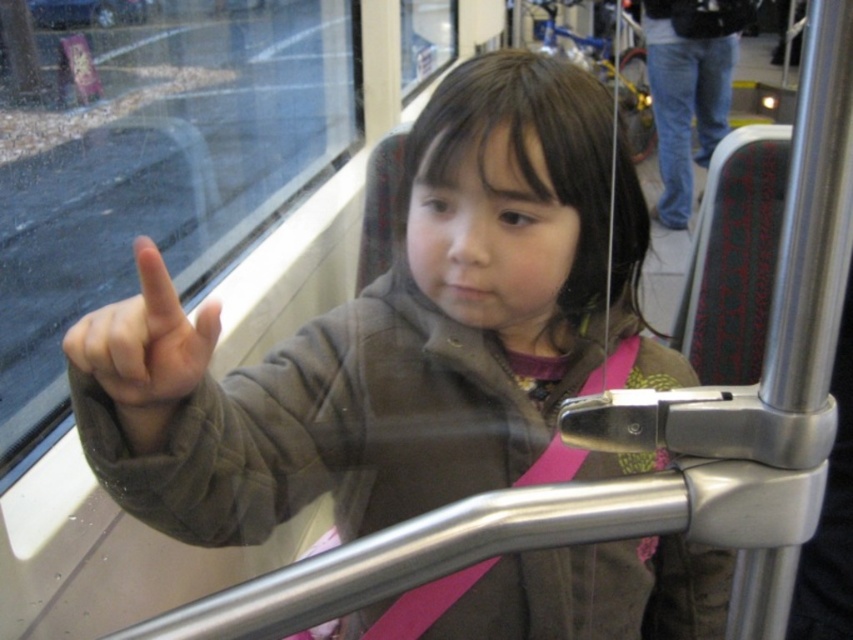
Does brown matte jacket at center have a lesser height compared to jeans at upper right?

Indeed, brown matte jacket at center has a lesser height compared to jeans at upper right.

The height and width of the screenshot is (640, 853). Identify the location of brown matte jacket at center. (389, 333).

Which is behind, point (676, 625) or point (209, 358)?

The point (676, 625) is behind.

From the picture: Does brown matte jacket at center have a lesser height compared to matte brown finger at upper left?

No, brown matte jacket at center is not shorter than matte brown finger at upper left.

Does point (480, 420) come closer to viewer compared to point (164, 333)?

That is False.

Find the location of a particular element. Image resolution: width=853 pixels, height=640 pixels. brown matte jacket at center is located at coordinates (389, 333).

Is point (685, 109) positioned in front of point (125, 307)?

No, it is behind (125, 307).

Does jeans at upper right lie in front of matte brown finger at upper left?

No.

Is point (668, 3) positioned after point (78, 333)?

Yes, it is behind point (78, 333).

Find the location of a particular element. The image size is (853, 640). jeans at upper right is located at coordinates (689, 88).